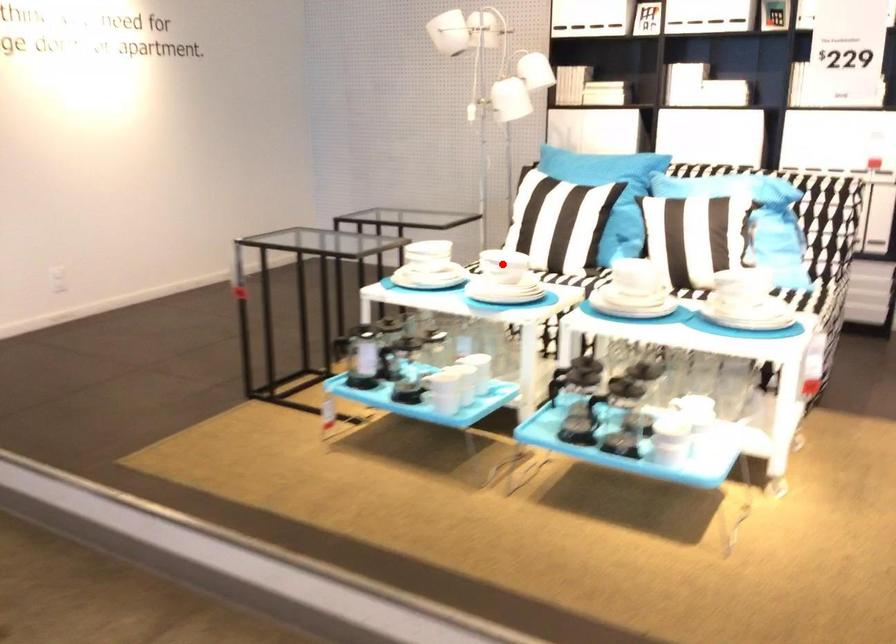
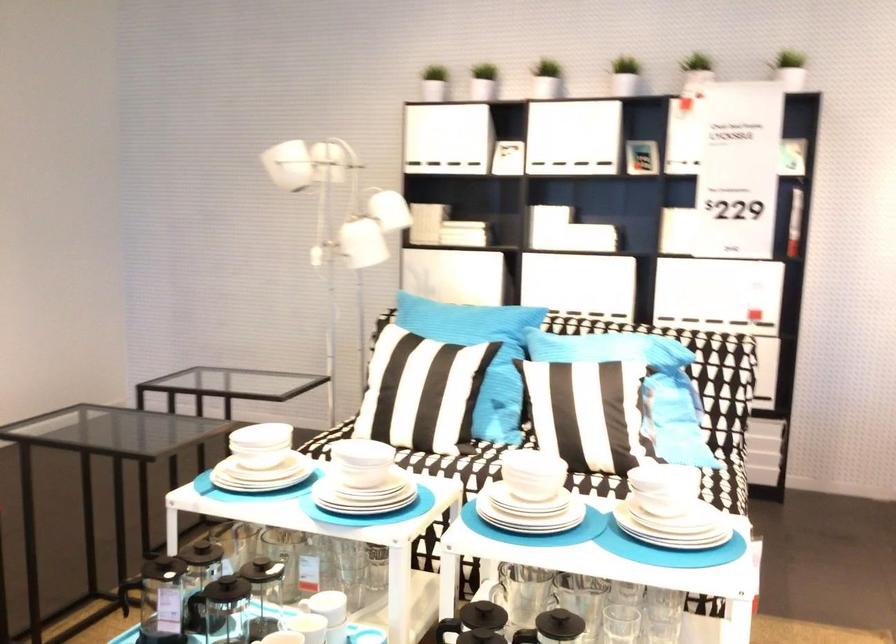
Question: I am providing you with two images of the same scene from different viewpoints. Given a red point in image1, look at the same physical point in image2. Is it:

Choices:
 (A) Closer to the viewpoint
 (B) Farther from the viewpoint

Answer: (A)